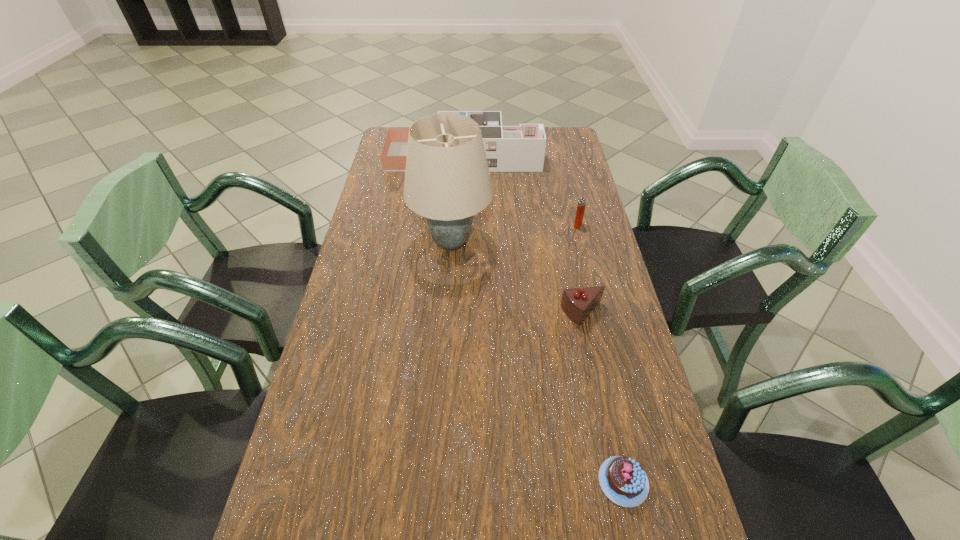
The image size is (960, 540). I want to click on vacant space situated on the front of the third tallest object, so click(586, 256).

The height and width of the screenshot is (540, 960). Find the location of `vacant space positioned on the left of the fourth farthest object`. vacant space positioned on the left of the fourth farthest object is located at coordinates (540, 313).

Where is `free space located on the left of the shortest object`? Image resolution: width=960 pixels, height=540 pixels. free space located on the left of the shortest object is located at coordinates (482, 482).

What are the coordinates of `object that is at the far edge` in the screenshot? It's located at (521, 148).

Find the location of a particular element. object located in the left edge section of the desktop is located at coordinates (521, 148).

The height and width of the screenshot is (540, 960). What are the coordinates of `dollhouse situated at the right edge` in the screenshot? It's located at (521, 148).

Where is `igniter at the right edge`? The width and height of the screenshot is (960, 540). igniter at the right edge is located at coordinates (581, 206).

Find the location of a particular element. object that is at the far left corner is located at coordinates (521, 148).

This screenshot has width=960, height=540. I want to click on object situated at the far right corner, so click(521, 148).

In order to click on vacant area at the left edge of the desktop in this screenshot , I will do click(397, 294).